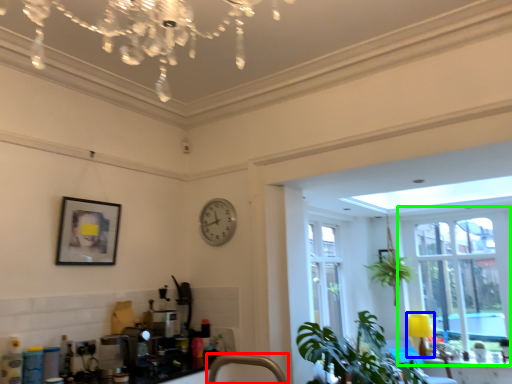
Question: Which object is positioned closest to faucet (highlighted by a red box)? Select from lamp (highlighted by a blue box) and window (highlighted by a green box).

Choices:
 (A) lamp
 (B) window

Answer: (B)